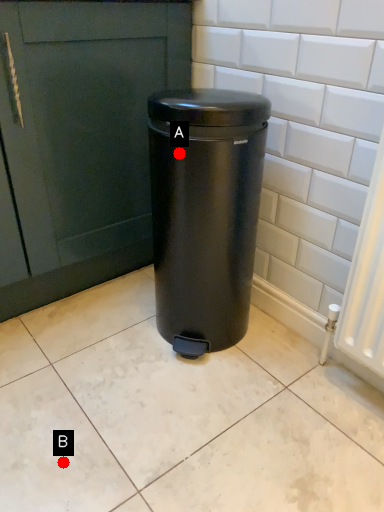
Question: Two points are circled on the image, labeled by A and B beside each circle. Among these points, which one is nearest to the camera?

Choices:
 (A) A is closer
 (B) B is closer

Answer: (B)